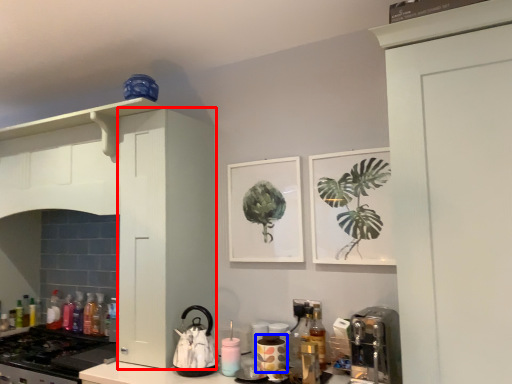
Question: Which of the following is the farthest to the observer, cabinetry (highlighted by a red box) or appliance (highlighted by a blue box)?

Choices:
 (A) cabinetry
 (B) appliance

Answer: (A)